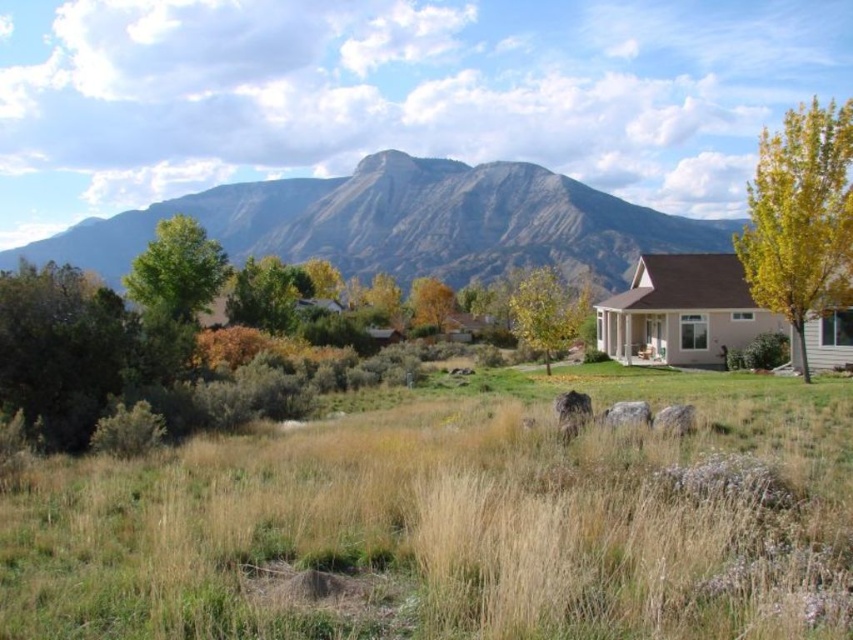
Based on the photo, is dry grass at center taller than yellow leafy tree at center?

In fact, dry grass at center may be shorter than yellow leafy tree at center.

Who is positioned more to the left, dry grass at center or yellow leafy tree at center?

yellow leafy tree at center is more to the left.

In the scene shown: Who is more forward, (257,512) or (444,298)?

Positioned in front is point (257,512).

Locate an element on the screen. The width and height of the screenshot is (853, 640). dry grass at center is located at coordinates (453, 525).

Can you confirm if dry grass at center is bigger than yellow-green foliage at right?

No.

Between dry grass at center and yellow-green foliage at right, which one appears on the right side from the viewer's perspective?

yellow-green foliage at right

From the picture: Who is more forward, (410, 602) or (827, 132)?

Point (410, 602) is more forward.

The width and height of the screenshot is (853, 640). I want to click on dry grass at center, so click(x=453, y=525).

Does green leafy tree at center appear on the left side of yellow-green foliage at center?

Correct, you'll find green leafy tree at center to the left of yellow-green foliage at center.

Who is more forward, (x=33, y=369) or (x=532, y=296)?

Point (x=33, y=369)

Image resolution: width=853 pixels, height=640 pixels. In order to click on green leafy tree at center in this screenshot , I will do 125,326.